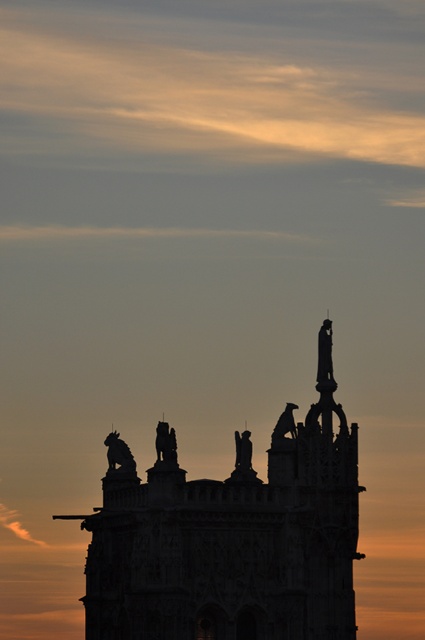
Question: Is silhouette stone tower at center closer to camera compared to matte stone statue at upper center?

Choices:
 (A) no
 (B) yes

Answer: (B)

Question: Which point appears farthest from the camera in this image?

Choices:
 (A) (246, 448)
 (B) (158, 525)
 (C) (127, 476)
 (D) (275, 432)

Answer: (A)

Question: Based on their relative distances, which object is nearer to the silvery metal statue at upper center?

Choices:
 (A) matte bronze statue at center
 (B) matte stone statue at upper center
 (C) silhouette stone tower at center

Answer: (B)

Question: Is silhouette stone tower at center positioned at the back of sculpted stone statue at center?

Choices:
 (A) no
 (B) yes

Answer: (A)

Question: In this image, where is sculpted stone figure at upper center located relative to matte stone statue at upper center?

Choices:
 (A) left
 (B) right

Answer: (A)

Question: Based on their relative distances, which object is nearer to the silvery metal statue at upper center?

Choices:
 (A) sculpted stone figure at upper center
 (B) sculpted stone statue at center

Answer: (B)